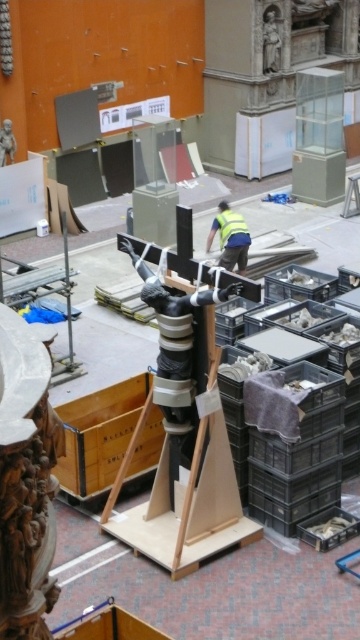
Question: Is black matte crucifix at center thinner than yellow reflective vest at center?

Choices:
 (A) no
 (B) yes

Answer: (A)

Question: Which object is closer to the camera taking this photo?

Choices:
 (A) black matte crucifix at center
 (B) yellow reflective vest at center

Answer: (A)

Question: Can you confirm if black matte crucifix at center is positioned above yellow reflective vest at center?

Choices:
 (A) no
 (B) yes

Answer: (A)

Question: Does black matte crucifix at center have a greater width compared to yellow reflective vest at center?

Choices:
 (A) yes
 (B) no

Answer: (A)

Question: Among these points, which one is farthest from the camera?

Choices:
 (A) [174, 336]
 (B) [240, 244]

Answer: (B)

Question: Which of the following is the farthest from the observer?

Choices:
 (A) (177, 365)
 (B) (235, 252)

Answer: (B)